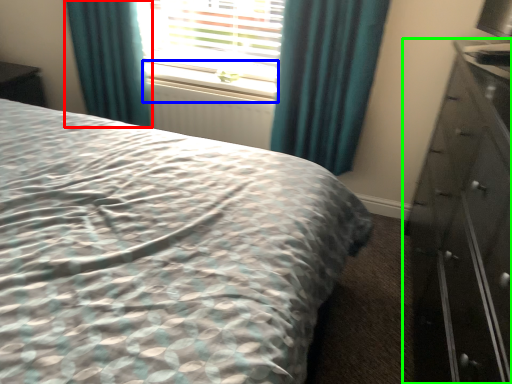
Question: Based on their relative distances, which object is farther from curtain (highlighted by a red box)? Choose from window sill (highlighted by a blue box) and chest of drawers (highlighted by a green box).

Choices:
 (A) window sill
 (B) chest of drawers

Answer: (B)